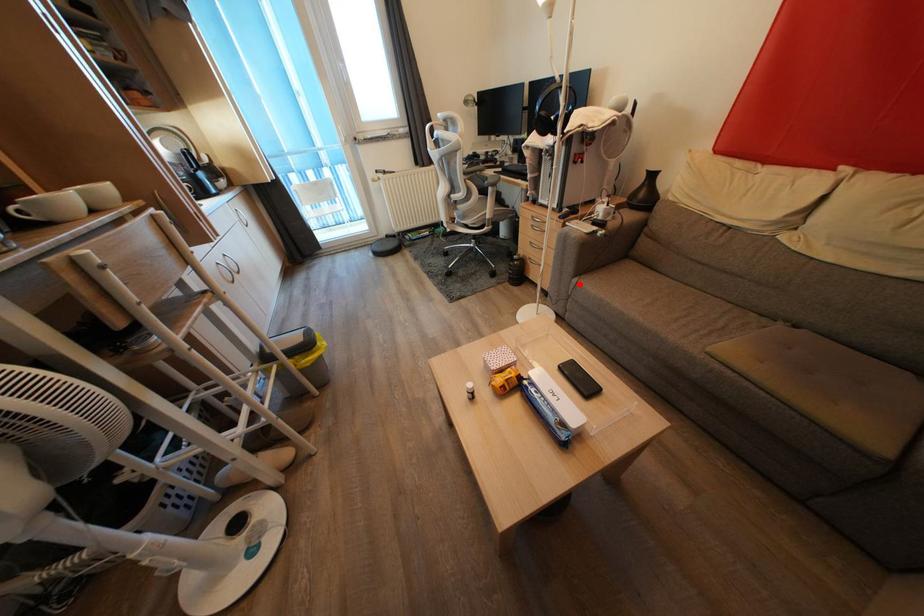
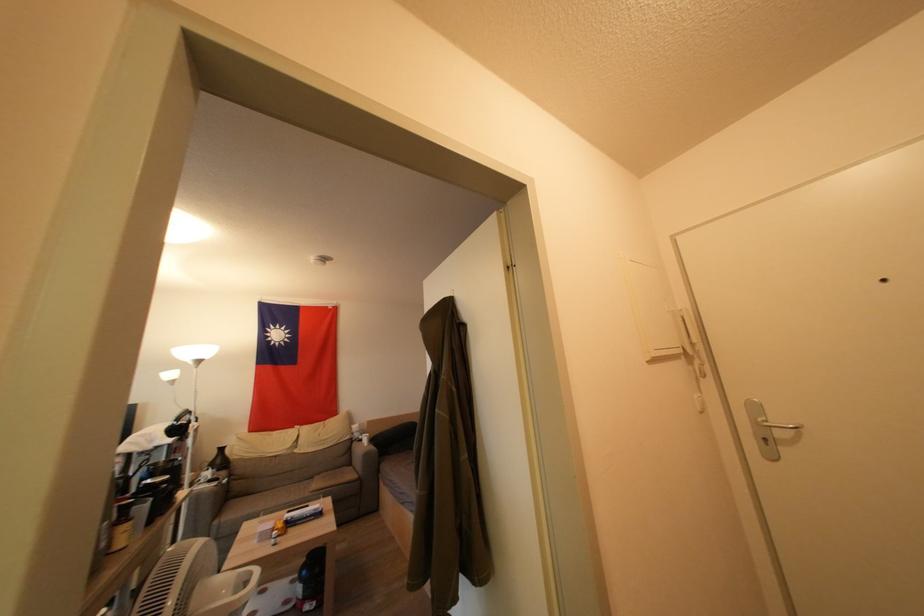
In the second image, find the point that corresponds to the highlighted location in the first image.

(221, 525)